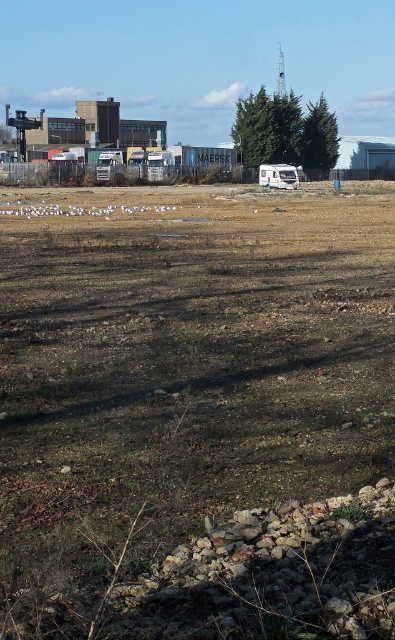
Between green textured tree at upper center and white plastic camper at center, which one has more height?

Standing taller between the two is green textured tree at upper center.

Between point (310, 134) and point (287, 186), which one is positioned in front?

Positioned in front is point (287, 186).

You are a GUI agent. You are given a task and a screenshot of the screen. Output one action in this format:
    pyautogui.click(x=<x>, y=<y>)
    Task: Click on the green textured tree at upper center
    
    Given the screenshot: What is the action you would take?
    pyautogui.click(x=319, y=138)

Who is taller, brown soil at center or white plastic camper at center?

white plastic camper at center

Which is below, brown soil at center or white plastic camper at center?

brown soil at center is lower down.

Identify the location of brown soil at center. This screenshot has width=395, height=640. (197, 412).

Is point (169, 282) positioned in front of point (317, 154)?

That is True.

Does brown soil at center have a lesser height compared to green textured tree at upper center?

Correct, brown soil at center is not as tall as green textured tree at upper center.

Who is more forward, (216, 417) or (316, 140)?

Point (216, 417) is more forward.

Where is `brown soil at center`? brown soil at center is located at coordinates (197, 412).